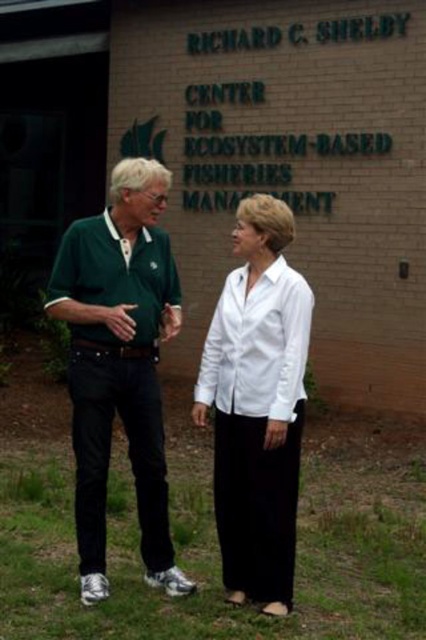
Question: Is the position of green jersey at center less distant than that of white smooth blouse at center?

Choices:
 (A) no
 (B) yes

Answer: (A)

Question: Which of the following is the farthest from the observer?

Choices:
 (A) white smooth shirt at center
 (B) green jersey at center

Answer: (B)

Question: Estimate the real-world distances between objects in this image. Which object is farther from the white smooth shirt at center?

Choices:
 (A) green jersey at center
 (B) white smooth blouse at center

Answer: (A)

Question: Which object is farther from the camera taking this photo?

Choices:
 (A) green jersey at center
 (B) white smooth blouse at center

Answer: (A)

Question: Is the position of white smooth blouse at center more distant than that of white smooth shirt at center?

Choices:
 (A) yes
 (B) no

Answer: (B)

Question: Observing the image, what is the correct spatial positioning of white smooth blouse at center in reference to white smooth shirt at center?

Choices:
 (A) right
 (B) left

Answer: (B)